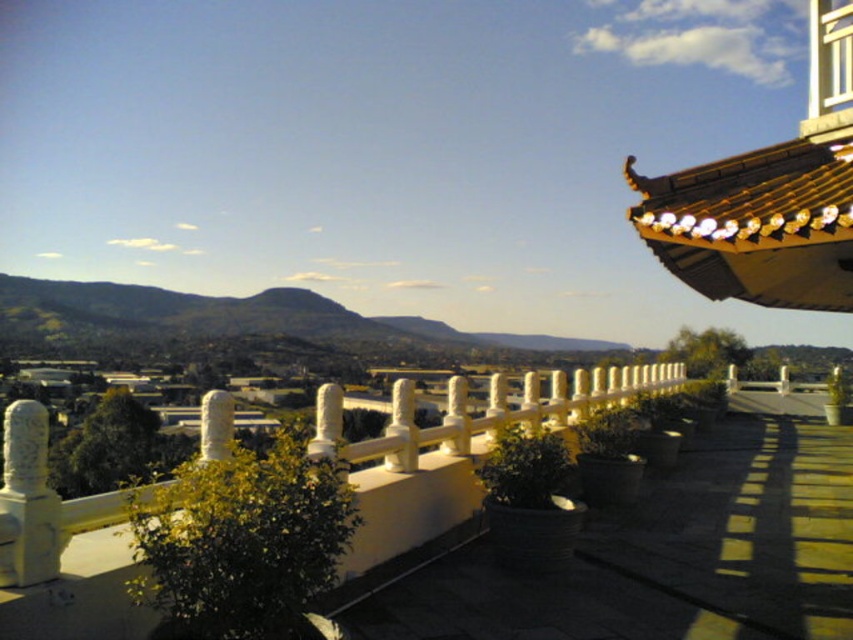
Between white stone pillar at left and white stone pillar at center, which one appears on the right side from the viewer's perspective?

white stone pillar at center

Is white stone pillar at left in front of white stone pillar at center?

Yes, it is.

Is point (38, 477) more distant than point (212, 433)?

No, (38, 477) is in front of (212, 433).

Locate an element on the screen. The image size is (853, 640). white stone pillar at left is located at coordinates (27, 499).